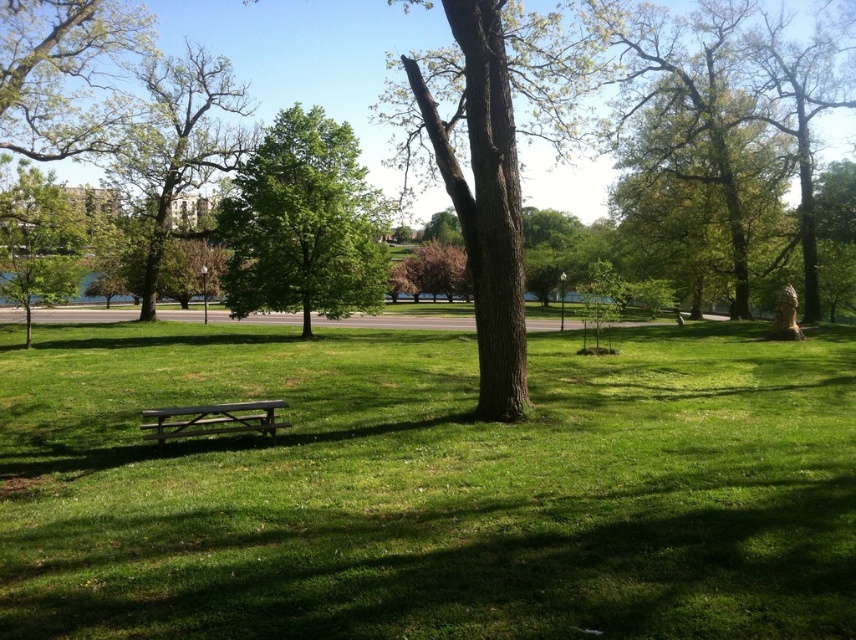
You are planning to set up a picnic blanket in the park. You want to place it between the green leafy tree at center and the green leafy tree at left. Which tree should you position the blanket closer to if you want it to be under the shade of the tree that is further to the right?

The green leafy tree at center is positioned on the right side of green leafy tree at left. Therefore, to place the picnic blanket under the shade of the tree further to the right, you should position it closer to the green leafy tree at center.

You are standing at the entrance of the park and want to find the green leafy tree at center. According to the coordinate system where the bottom left corner is 0,0 and the top right is 1,1, is the tree closer to the top or the bottom of the image?

The green leafy tree at center is located at point [302,225], which means it is closer to the bottom of the image since the y coordinate is less than 0.5.